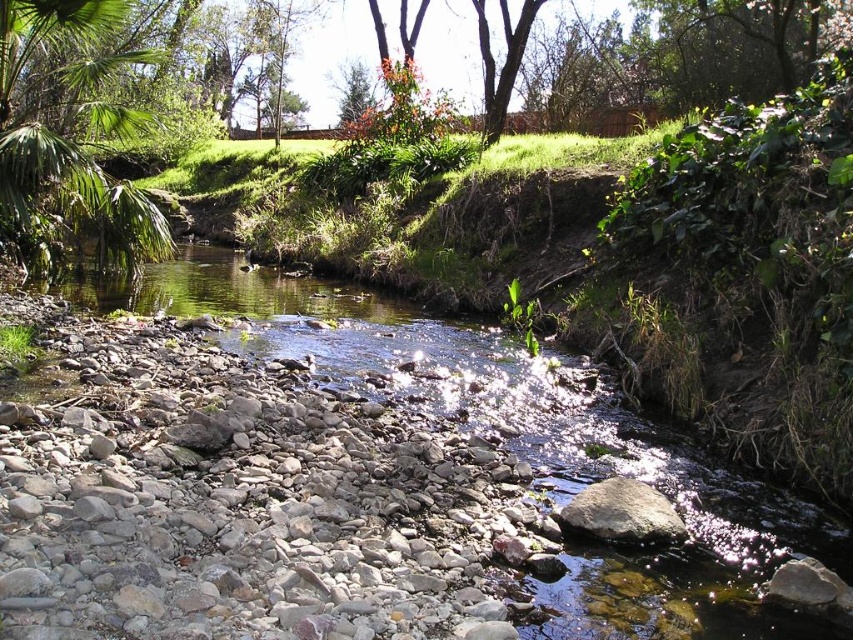
Is orange leafy tree at upper center wider than brown rough tree at upper center?

Correct, the width of orange leafy tree at upper center exceeds that of brown rough tree at upper center.

Who is more distant from viewer, [387,90] or [480,10]?

Positioned behind is point [387,90].

You are a GUI agent. You are given a task and a screenshot of the screen. Output one action in this format:
    pyautogui.click(x=<x>, y=<y>)
    Task: Click on the orange leafy tree at upper center
    This screenshot has width=853, height=640.
    Given the screenshot: What is the action you would take?
    398,77

Where is `orange leafy tree at upper center`? This screenshot has width=853, height=640. orange leafy tree at upper center is located at coordinates (398, 77).

Is gray/rough rocks at center positioned at the back of green leafy palm at left?

No, it is in front of green leafy palm at left.

Measure the distance from gray/rough rocks at center to green leafy palm at left.

gray/rough rocks at center is 26.23 feet away from green leafy palm at left.

Where is `gray/rough rocks at center`? This screenshot has width=853, height=640. gray/rough rocks at center is located at coordinates click(241, 506).

This screenshot has height=640, width=853. What do you see at coordinates (68, 136) in the screenshot? I see `green leafy palm at left` at bounding box center [68, 136].

Does point (54, 179) come closer to viewer compared to point (413, 97)?

Yes, point (54, 179) is closer to viewer.

Where is `green leafy palm at left`? This screenshot has height=640, width=853. green leafy palm at left is located at coordinates (68, 136).